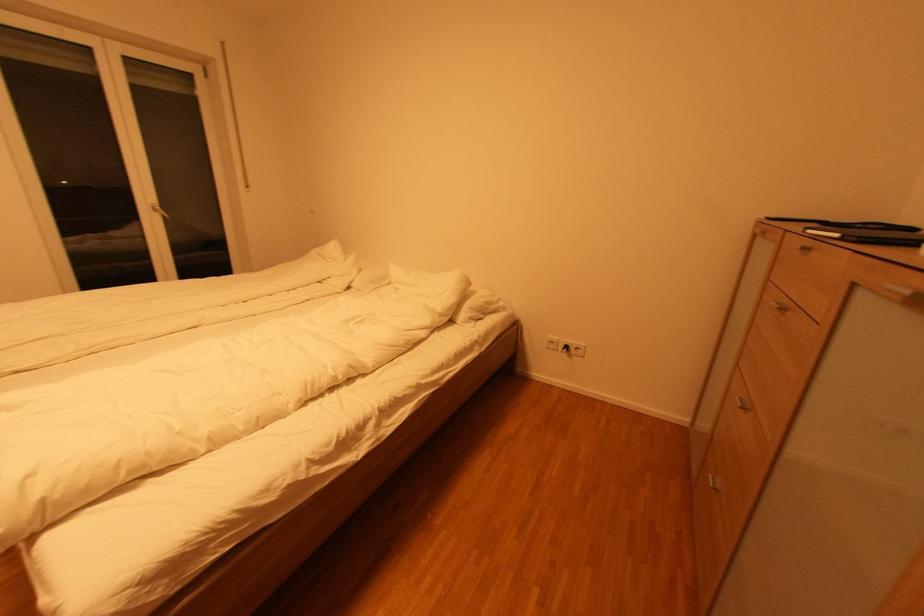
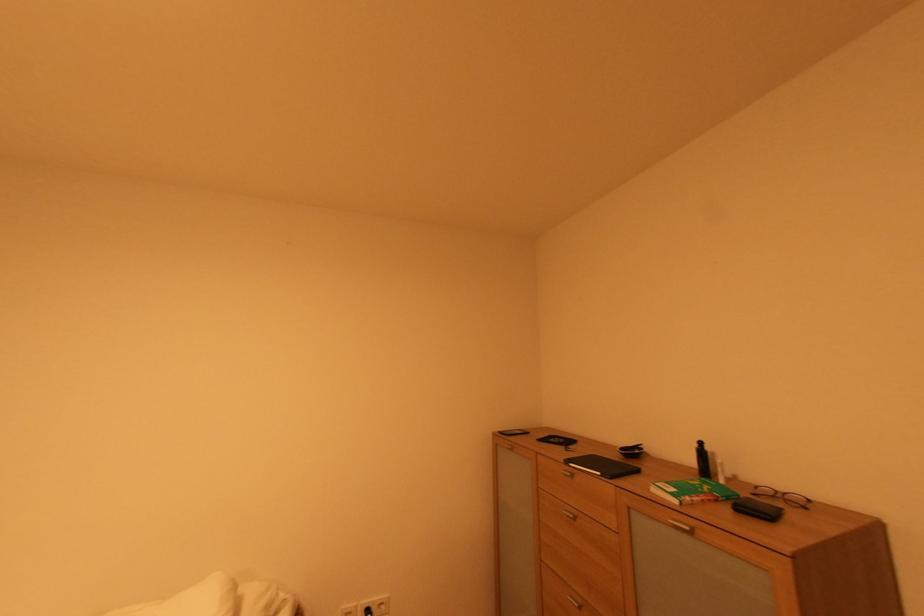
The point at (784, 304) is marked in the first image. Where is the corresponding point in the second image?

(572, 512)